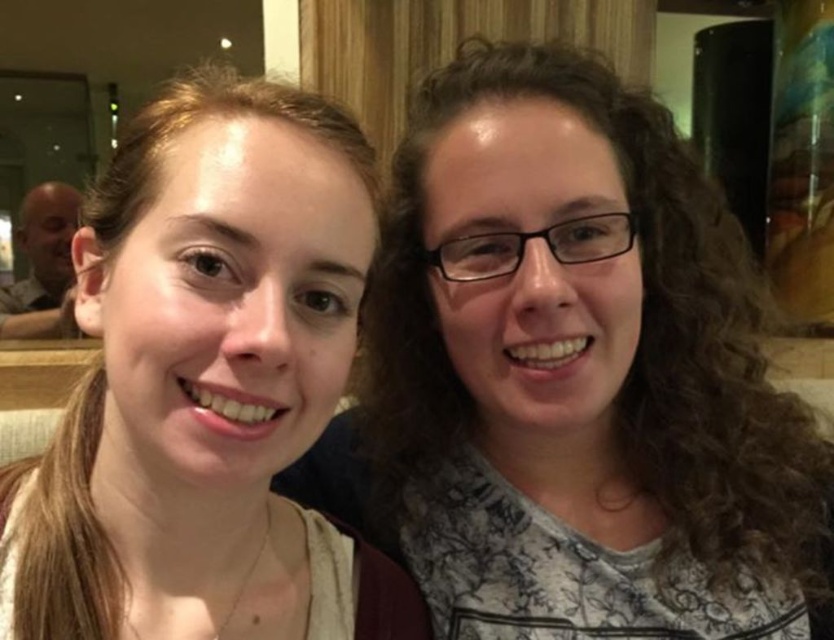
From the picture: You are holding a camera and want to take a selfie with two friends. You are standing at the point marked as point (403,234). The camera is 25.72 inches away from this point. Can you estimate if you need to move closer or farther away to ensure both friends are in focus?

The distance between point (403,234) and the camera is 25.72 inches. To ensure both friends are in focus, you should move closer to reduce the distance, as the current distance might be too far for the camera to maintain focus on both subjects simultaneously.

You are taking a photo of two people. You notice the matte black hair at upper right and the matte brown hair at left. Which hair is larger in the photo?

The matte black hair at upper right is bigger than the matte brown hair at left, so the matte black hair at upper right appears larger in the photo.

You are taking a photo of two friends in a cafe. You notice two specific points in the image at coordinates point (756,346) and point (208,198). Which point is closer to the camera?

Point (756,346) is further to the camera than point (208,198), so the closer point to the camera is point (208,198).